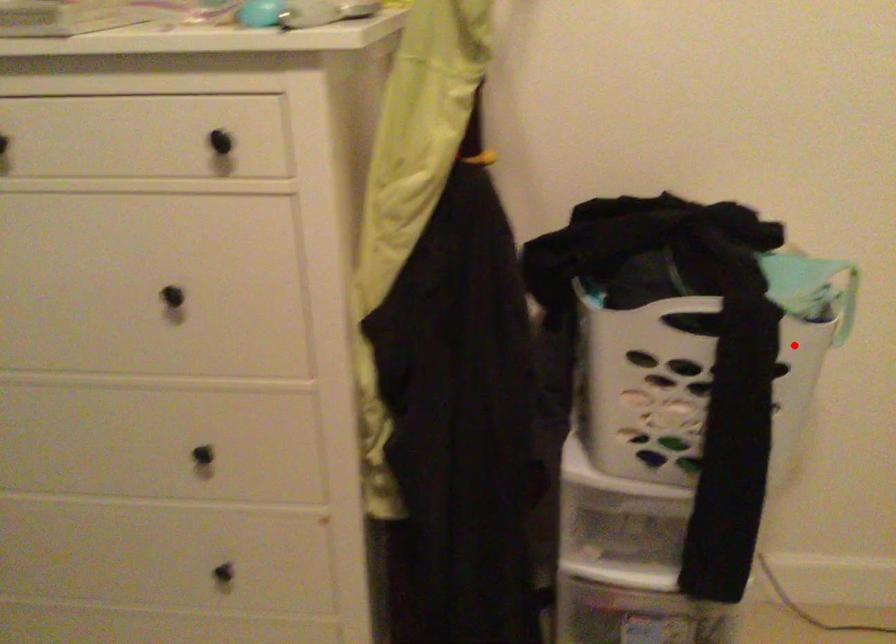
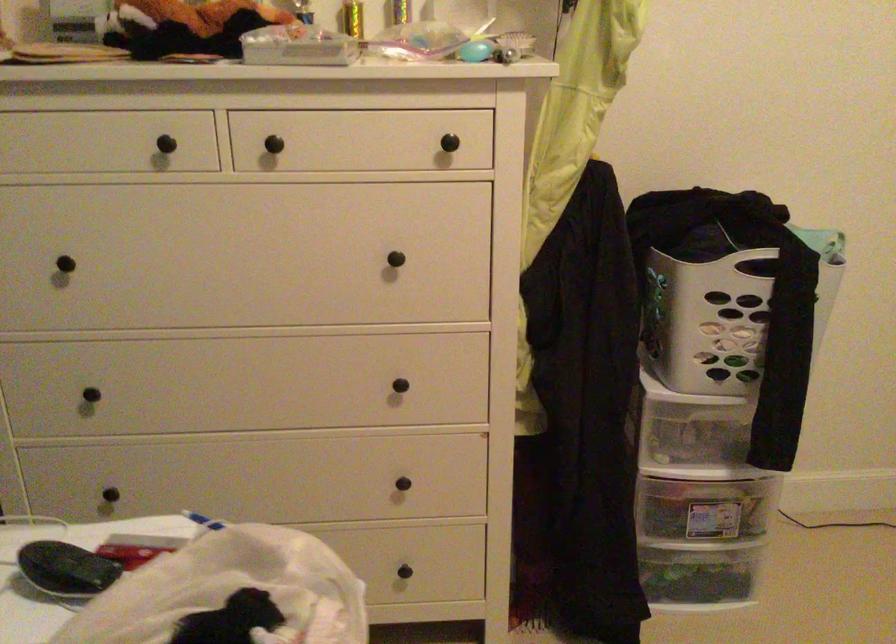
Question: I am providing you with two images of the same scene from different viewpoints. Image1 has a red point marked. In image2, the corresponding 3D location appears at what relative position? Reply with the corresponding letter.

Choices:
 (A) Closer
 (B) Farther

Answer: (B)